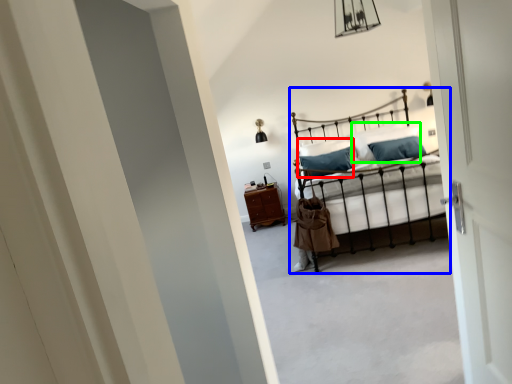
Question: Which object is the closest to the pillow (highlighted by a red box)? Choose among these: bed (highlighted by a blue box) or pillow (highlighted by a green box).

Choices:
 (A) bed
 (B) pillow

Answer: (A)